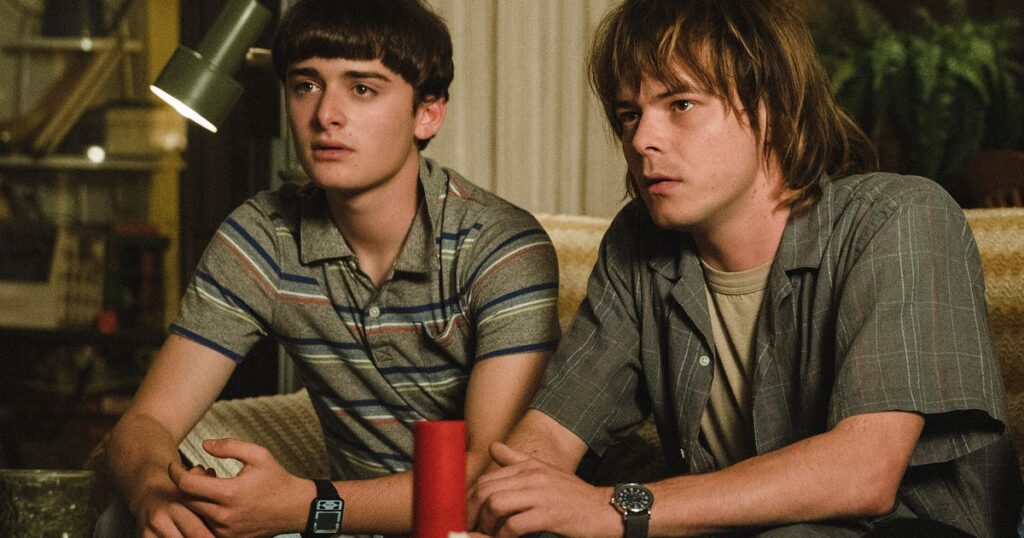
The height and width of the screenshot is (538, 1024). Identify the location of wooden chair. (1001, 181).